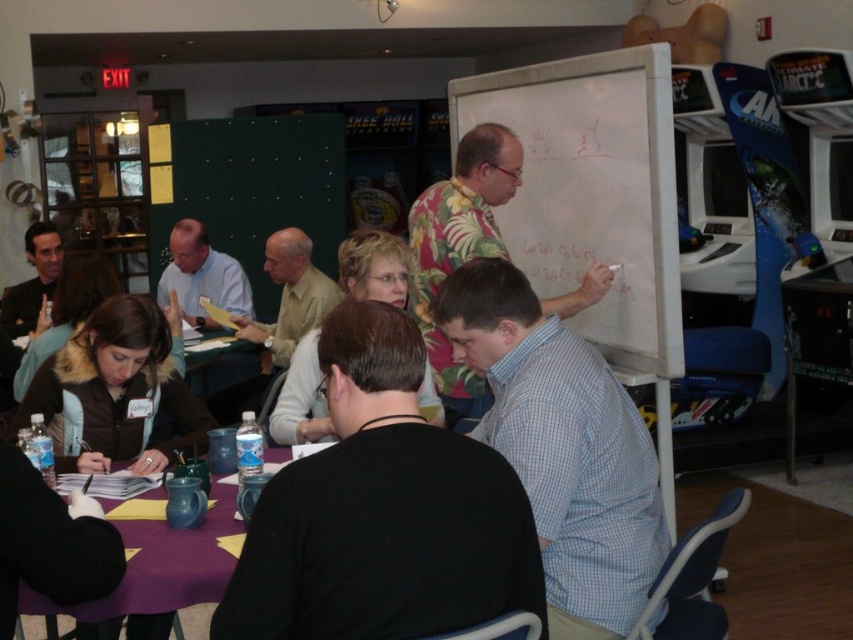
Question: Does black shirt at center have a larger size compared to white matte whiteboard at upper center?

Choices:
 (A) no
 (B) yes

Answer: (A)

Question: Which of the following is the closest to the observer?

Choices:
 (A) black shirt at center
 (B) floral shirt at center
 (C) purple fabric table at lower center

Answer: (A)

Question: Among these objects, which one is nearest to the camera?

Choices:
 (A) blue checkered shirt at center
 (B) matte black jacket at upper left

Answer: (A)

Question: Is black shirt at center positioned at the back of matte black jacket at upper left?

Choices:
 (A) no
 (B) yes

Answer: (A)

Question: Is blue checkered shirt at center below light beige shirt at center?

Choices:
 (A) yes
 (B) no

Answer: (A)

Question: Considering the real-world distances, which object is farthest from the blue checkered shirt at center?

Choices:
 (A) light beige shirt at center
 (B) purple fabric table at lower center

Answer: (B)